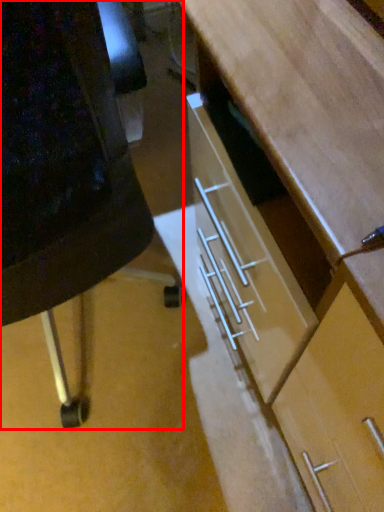
Question: From the image's perspective, what is the correct spatial positioning of furniture (annotated by the red box) in reference to desk?

Choices:
 (A) below
 (B) above

Answer: (A)